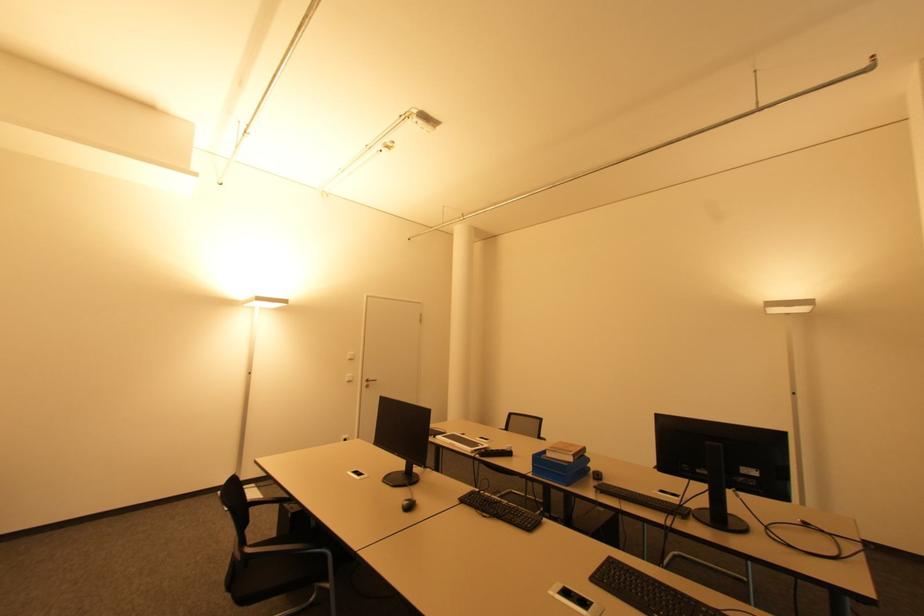
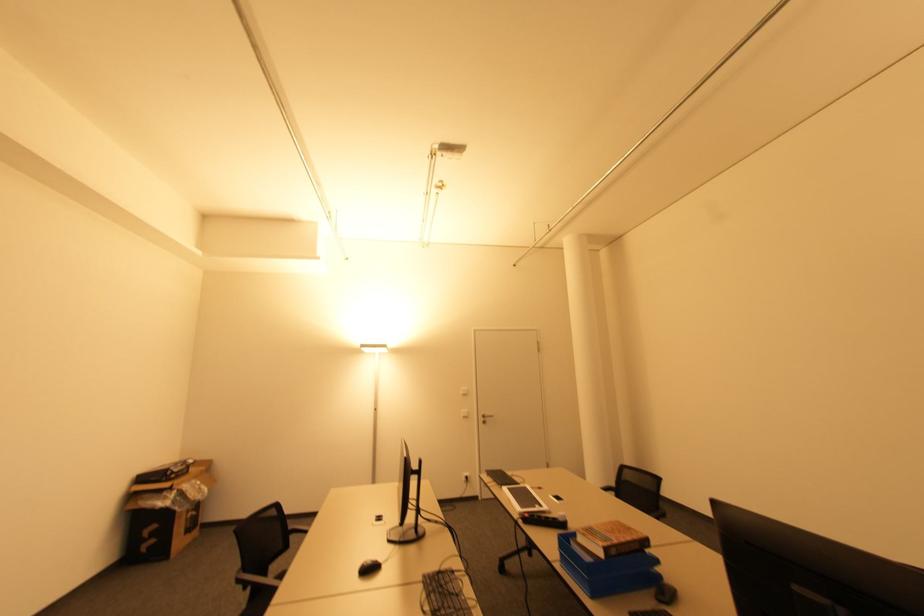
In the second image, find the point that corresponds to (569,485) in the first image.

(594, 597)